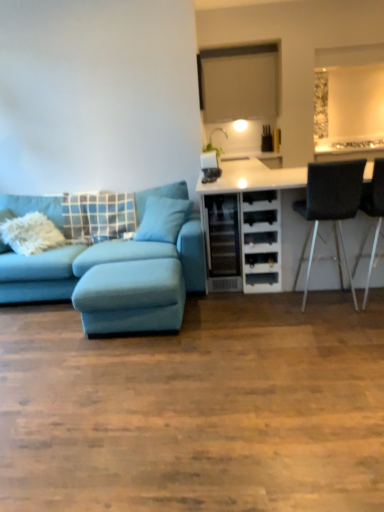
The image size is (384, 512). I want to click on free space to the left of black leather chair at right, which is the 1th chair in left-to-right order, so pos(281,307).